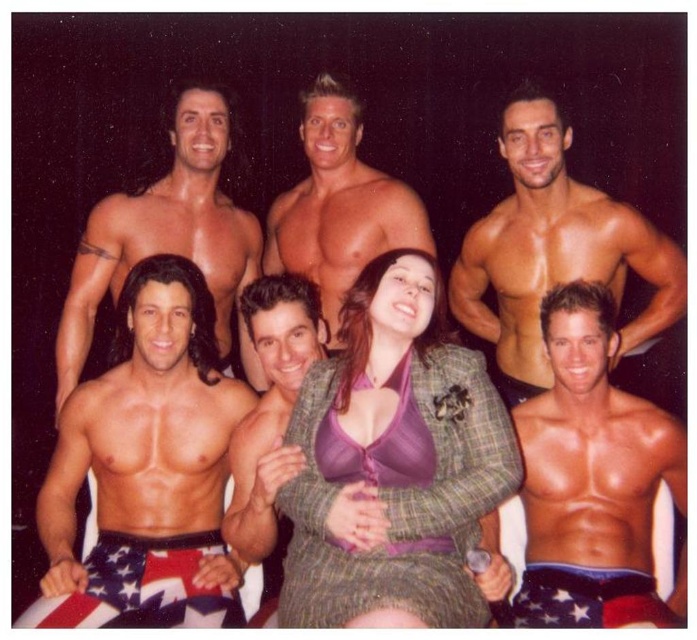
You are a photographer adjusting your camera settings to capture the group photo. The plaid fabric blazer at center and the muscular tan skin at upper center are part of the composition. Given their distance apart, can you focus on both elements simultaneously using a standard camera lens with a depth of field of 28 inches?

The plaid fabric blazer at center and muscular tan skin at upper center are 27.75 inches apart from each other. Since the depth of field is 28 inches, which is slightly larger than the distance between them, the camera can focus on both elements simultaneously.

Looking at the group photo with the dark background, where is the smooth skin torso at center in relation to the muscular tan skin at upper center?

The smooth skin torso at center is located to the right of the muscular tan skin at upper center.

You are a photographer adjusting lighting for a photo shoot. You need to ensure that the plaid fabric blazer at center and the smooth skin torso at center are both well illuminated. Considering their sizes, which object requires a wider light spread to cover its entire surface?

The plaid fabric blazer at center has a greater height compared to the smooth skin torso at center, so it requires a wider light spread to cover its entire surface.